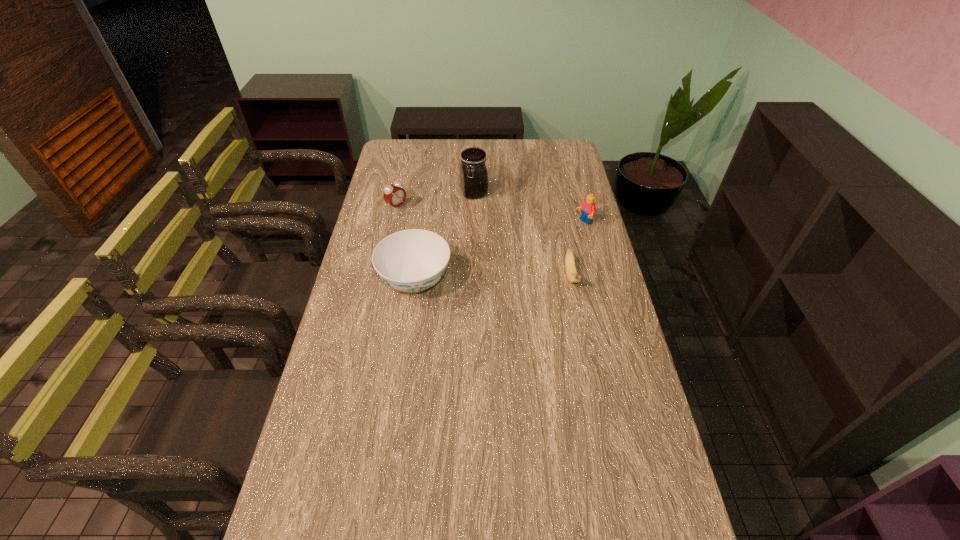
Locate an element on the screen. This screenshot has height=540, width=960. alarm clock that is at the left edge is located at coordinates (393, 194).

What are the coordinates of `banana located in the right edge section of the desktop` in the screenshot? It's located at (572, 275).

Where is `Lego at the right edge`? This screenshot has width=960, height=540. Lego at the right edge is located at coordinates (588, 207).

What are the coordinates of `blank space at the far edge of the desktop` in the screenshot? It's located at (535, 151).

Where is `free space at the near edge of the desktop`? The width and height of the screenshot is (960, 540). free space at the near edge of the desktop is located at coordinates (384, 502).

Locate an element on the screen. This screenshot has height=540, width=960. free space at the left edge of the desktop is located at coordinates (350, 367).

In the image, there is a desktop. Identify the location of free region at the right edge. The height and width of the screenshot is (540, 960). (596, 464).

I want to click on vacant region at the far left corner of the desktop, so click(419, 141).

Identify the location of free location at the far right corner. (562, 139).

Identify the location of vacant space that's between the chinaware and the rightmost object. This screenshot has height=540, width=960. click(499, 252).